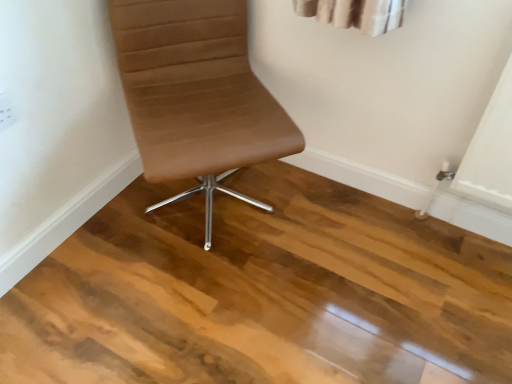
Where is `vacant space underneath brown leather chair at center (from a real-world perspective)`? The width and height of the screenshot is (512, 384). vacant space underneath brown leather chair at center (from a real-world perspective) is located at coordinates (213, 210).